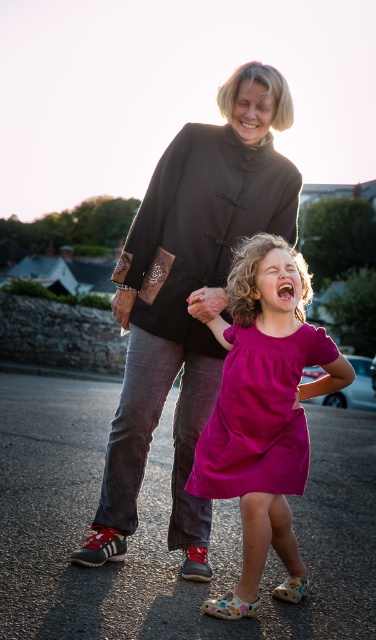
You are a photographer trying to capture the best shot of the grandmother and granddaughter. Since you want to focus on the granddaughter in the pink fabric dress at center, should you adjust your camera to avoid the black cotton sweater at upper center blocking her?

The black cotton sweater at upper center is positioned over the pink fabric dress at center, so yes, adjusting the camera angle would help avoid the sweater blocking the dress.

Based on the photo, you are standing in front of the scene and want to touch both points. Which point should you reach first, point [172,468] or point [285,468]?

Point [172,468] is closer to you than point [285,468], so you should reach for point [172,468] first.